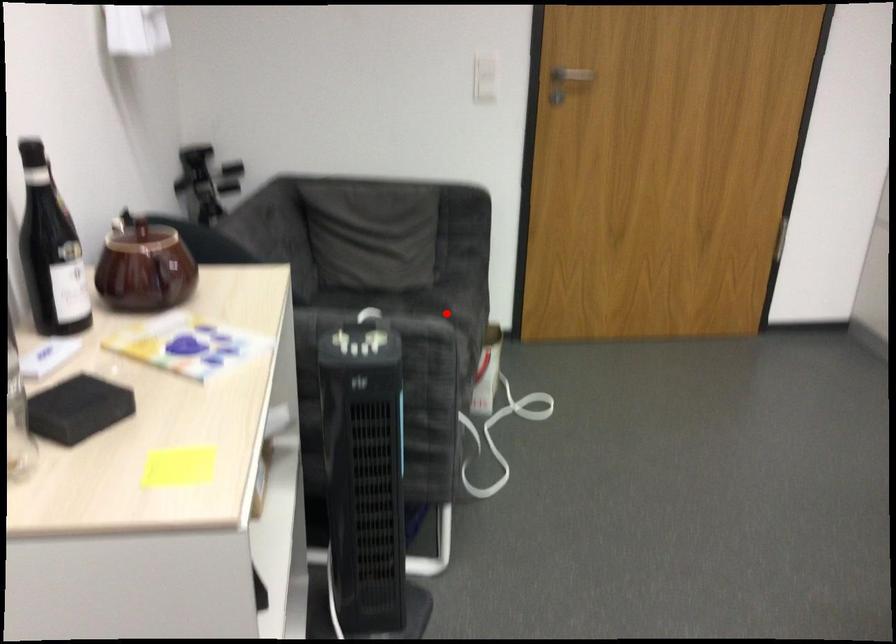
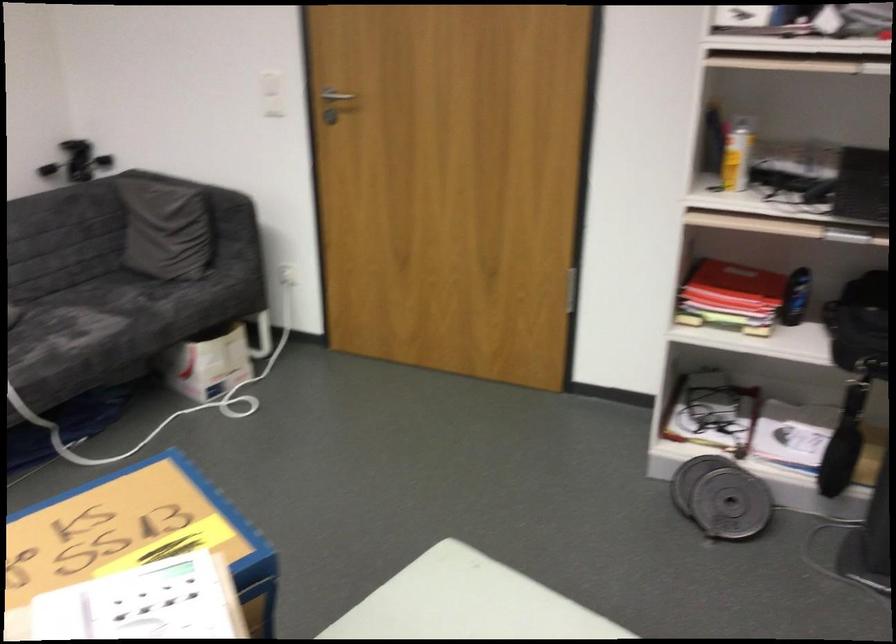
Question: I am providing you with two images of the same scene from different viewpoints. Given a red point in image1, look at the same physical point in image2. Is it:

Choices:
 (A) Closer to the viewpoint
 (B) Farther from the viewpoint

Answer: (B)